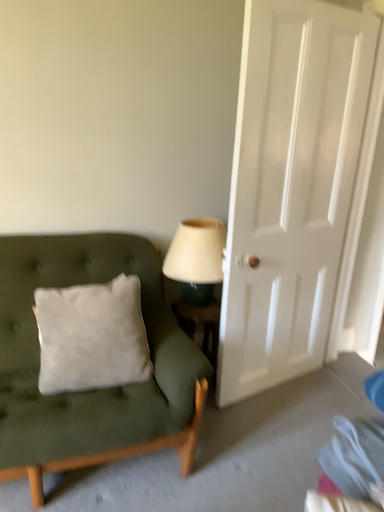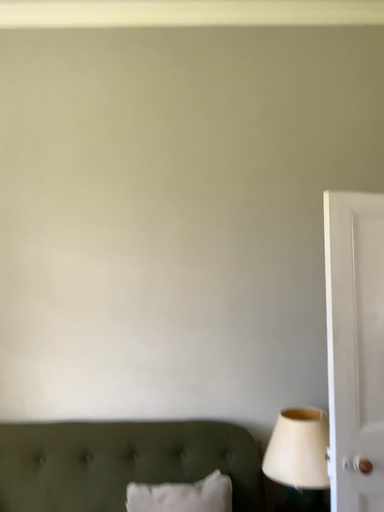
Question: How did the camera likely rotate when shooting the video?

Choices:
 (A) rotated downward
 (B) rotated upward

Answer: (B)